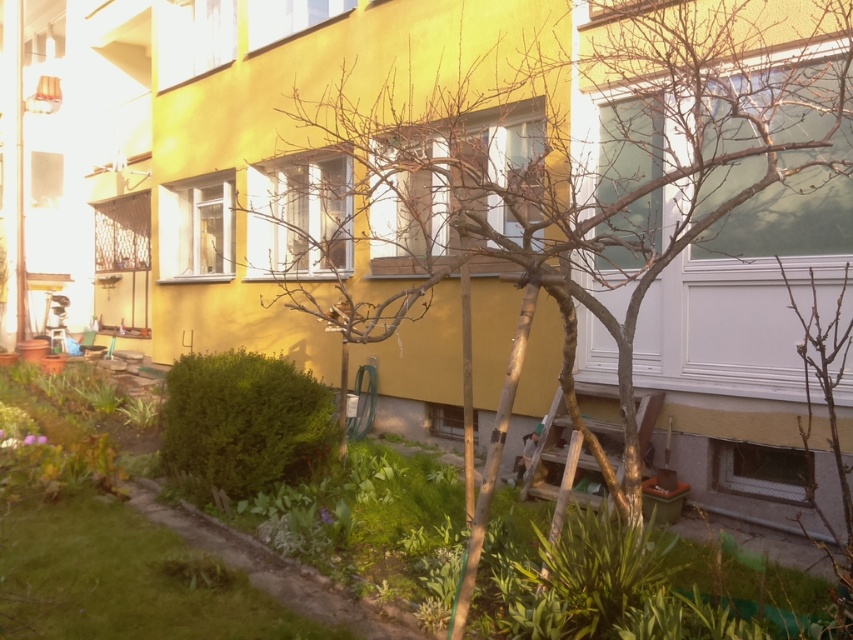
Who is higher up, bare wood tree at center or green grass at lower left?

bare wood tree at center

Which is more to the right, bare wood tree at center or green grass at lower left?

Positioned to the right is green grass at lower left.

Which is in front, point (709, 84) or point (18, 449)?

Point (709, 84) is in front.

The image size is (853, 640). In order to click on bare wood tree at center in this screenshot , I will do `click(589, 176)`.